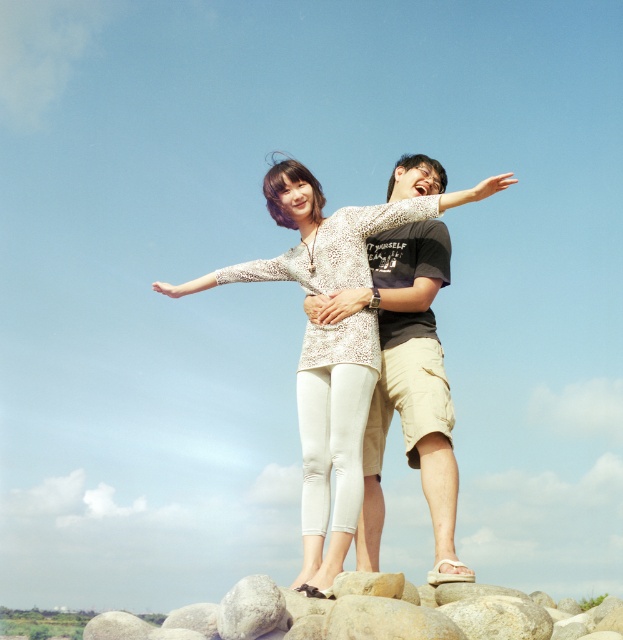
Who is higher up, black cotton t-shirt at center or smooth gray rock at lower center?

Positioned higher is black cotton t-shirt at center.

Who is lower down, black cotton t-shirt at center or smooth gray rock at lower center?

Positioned lower is smooth gray rock at lower center.

I want to click on black cotton t-shirt at center, so click(x=406, y=381).

Is white lace blouse at center closer to the viewer compared to black cotton t-shirt at center?

That is False.

Where is `white lace blouse at center`? white lace blouse at center is located at coordinates (333, 435).

Which is below, white lace blouse at center or smooth gray rock at lower center?

smooth gray rock at lower center is lower down.

Based on the photo, which of these two, white lace blouse at center or smooth gray rock at lower center, stands taller?

With more height is smooth gray rock at lower center.

Does point (340, 275) come farther from viewer compared to point (505, 614)?

Yes, it is.

The image size is (623, 640). I want to click on white lace blouse at center, so click(333, 435).